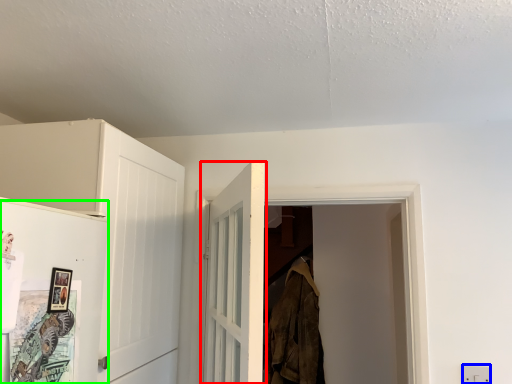
Question: Which object is positioned closest to door (highlighted by a red box)? Select from electric outlet (highlighted by a blue box) and door (highlighted by a green box).

Choices:
 (A) electric outlet
 (B) door

Answer: (B)